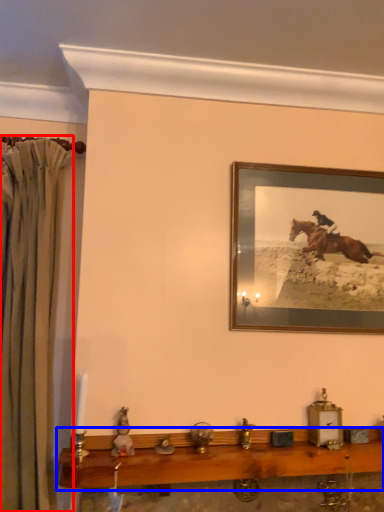
Question: Which of the following is the farthest to the observer, curtain (highlighted by a red box) or table (highlighted by a blue box)?

Choices:
 (A) curtain
 (B) table

Answer: (A)